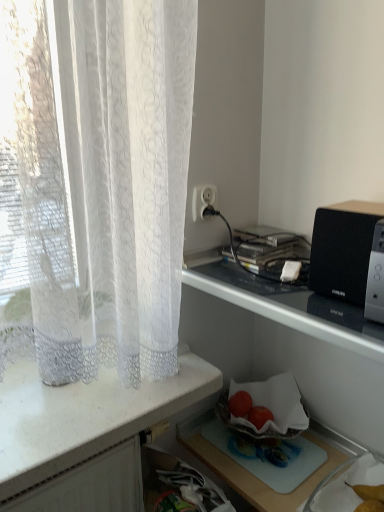
Measure the distance between yellow matte pear at lower right and camera.

A distance of 34.17 inches exists between yellow matte pear at lower right and camera.

This screenshot has width=384, height=512. I want to click on yellow matte pear at lower right, so click(369, 497).

Describe the element at coordinates (287, 342) in the screenshot. I see `metallic silver microwave at upper right` at that location.

Identify the location of white lace curtain at left. (85, 436).

Image resolution: width=384 pixels, height=512 pixels. Find the location of `smooth red strawberries at center, the first fruit when ordered from right to left`. smooth red strawberries at center, the first fruit when ordered from right to left is located at coordinates (259, 416).

What do you see at coordinates (259, 416) in the screenshot?
I see `smooth red strawberries at center, which is the second fruit from left to right` at bounding box center [259, 416].

At what (x,y) coordinates should I click in order to perform the action: click on white plastic socket at upper center. Please return your answer as a coordinate pair (x, y). Looking at the image, I should click on (203, 200).

Describe the element at coordinates (343, 250) in the screenshot. I see `black plastic speaker at upper right` at that location.

From the picture: What is the approximate width of translucent glass bowl at lower center?

The width of translucent glass bowl at lower center is 8.11 inches.

Measure the distance between point (x=229, y=408) and camera.

Point (x=229, y=408) is 3.77 feet from camera.

I want to click on yellow matte pear at lower right, so click(x=369, y=497).

Is translucent glass bowl at lower center far from red matte tomato at lower center, marked as the 2th fruit in a right-to-left arrangement?

They are positioned close to each other.

From the image's perspective, which is below, translucent glass bowl at lower center or red matte tomato at lower center, marked as the 2th fruit in a right-to-left arrangement?

translucent glass bowl at lower center, from the image's perspective.

Is translucent glass bowl at lower center wider or thinner than red matte tomato at lower center, which is the 1th fruit from left to right?

Clearly, translucent glass bowl at lower center has more width compared to red matte tomato at lower center, which is the 1th fruit from left to right.

Where is `table in front of the red matte tomato at lower center, marked as the 2th fruit in a right-to-left arrangement`? This screenshot has height=512, width=384. table in front of the red matte tomato at lower center, marked as the 2th fruit in a right-to-left arrangement is located at coordinates (249, 472).

In terms of height, does white plastic socket at upper center look taller or shorter compared to translucent glass bowl at lower center?

Considering their sizes, white plastic socket at upper center has more height than translucent glass bowl at lower center.

Is white plastic socket at upper center touching translucent glass bowl at lower center?

No, white plastic socket at upper center is not touching translucent glass bowl at lower center.

Does white plastic socket at upper center have a greater width compared to translucent glass bowl at lower center?

In fact, white plastic socket at upper center might be narrower than translucent glass bowl at lower center.

Is white plastic socket at upper center at the left side of translucent glass bowl at lower center?

Correct, you'll find white plastic socket at upper center to the left of translucent glass bowl at lower center.

Is yellow matte pear at lower right further to camera compared to white plastic socket at upper center?

No, the depth of yellow matte pear at lower right is less than that of white plastic socket at upper center.

Are yellow matte pear at lower right and white plastic socket at upper center far apart?

No.

Is yellow matte pear at lower right outside of white plastic socket at upper center?

yellow matte pear at lower right is positioned outside white plastic socket at upper center.

Is white plastic socket at upper center at the back of yellow matte pear at lower right?

No, yellow matte pear at lower right's orientation is not away from white plastic socket at upper center.

How distant is red matte tomato at lower center, marked as the 2th fruit in a right-to-left arrangement, from white plastic socket at upper center?

red matte tomato at lower center, marked as the 2th fruit in a right-to-left arrangement, is 20.89 inches away from white plastic socket at upper center.

Does red matte tomato at lower center, marked as the 2th fruit in a right-to-left arrangement, contain white plastic socket at upper center?

No, white plastic socket at upper center is not inside red matte tomato at lower center, marked as the 2th fruit in a right-to-left arrangement.

Based on the photo, is red matte tomato at lower center, marked as the 2th fruit in a right-to-left arrangement, to the left or to the right of white plastic socket at upper center in the image?

Clearly, red matte tomato at lower center, marked as the 2th fruit in a right-to-left arrangement, is on the right of white plastic socket at upper center in the image.

Is red matte tomato at lower center, marked as the 2th fruit in a right-to-left arrangement, far away from white plastic socket at upper center?

That's not correct — red matte tomato at lower center, marked as the 2th fruit in a right-to-left arrangement, is a little close to white plastic socket at upper center.

Is translucent glass bowl at lower center looking in the opposite direction of black plastic speaker at upper right?

No.

Is translucent glass bowl at lower center with black plastic speaker at upper right?

No, translucent glass bowl at lower center is not in contact with black plastic speaker at upper right.

What are the coordinates of `appliance on the right of translucent glass bowl at lower center` in the screenshot? It's located at (343, 250).

Image resolution: width=384 pixels, height=512 pixels. In the image, there is a smooth red strawberries at center, the first fruit when ordered from right to left. Identify the location of appliance above it (from the image's perspective). (343, 250).

Is smooth red strawberries at center, the first fruit when ordered from right to left, turned away from black plastic speaker at upper right?

No, smooth red strawberries at center, the first fruit when ordered from right to left, is not facing the opposite direction of black plastic speaker at upper right.

Considering the relative positions of smooth red strawberries at center, the first fruit when ordered from right to left, and black plastic speaker at upper right in the image provided, is smooth red strawberries at center, the first fruit when ordered from right to left, to the right of black plastic speaker at upper right from the viewer's perspective?

Incorrect, smooth red strawberries at center, the first fruit when ordered from right to left, is not on the right side of black plastic speaker at upper right.

Is smooth red strawberries at center, which is the second fruit from left to right, situated inside black plastic speaker at upper right or outside?

smooth red strawberries at center, which is the second fruit from left to right, exists outside the volume of black plastic speaker at upper right.

Considering the relative positions of metallic silver microwave at upper right and black plastic speaker at upper right in the image provided, is metallic silver microwave at upper right behind black plastic speaker at upper right?

No.

Could you tell me if metallic silver microwave at upper right is turned towards black plastic speaker at upper right?

No, metallic silver microwave at upper right is not oriented towards black plastic speaker at upper right.

Where is `shelf that appears below the black plastic speaker at upper right (from the image's perspective)`? shelf that appears below the black plastic speaker at upper right (from the image's perspective) is located at coordinates (287, 342).

Is metallic silver microwave at upper right next to black plastic speaker at upper right?

metallic silver microwave at upper right and black plastic speaker at upper right are clearly separated.

Locate an element on the screen. The image size is (384, 512). table that appears in front of the red matte tomato at lower center, which is the 1th fruit from left to right is located at coordinates (249, 472).

What are the coordinates of `table located on the right of white plastic socket at upper center` in the screenshot? It's located at (249, 472).

In the scene shown: When comparing their distances from red matte tomato at lower center, which is the 1th fruit from left to right, does white lace curtain at left or metallic silver microwave at upper right seem further?

white lace curtain at left is further to red matte tomato at lower center, which is the 1th fruit from left to right.

From the image, which object appears to be farther from red matte tomato at lower center, which is the 1th fruit from left to right, white lace curtain at left or translucent glass bowl at lower center?

white lace curtain at left lies further to red matte tomato at lower center, which is the 1th fruit from left to right, than the other object.

From the image, which object appears to be nearer to black plastic speaker at upper right, yellow matte pear at lower right or translucent glass bowl at lower center?

Based on the image, yellow matte pear at lower right appears to be nearer to black plastic speaker at upper right.

Which object lies further to the anchor point yellow matte pear at lower right, red matte tomato at lower center, which is the 1th fruit from left to right, or white lace curtain at left?

The object further to yellow matte pear at lower right is white lace curtain at left.

From the image, which object appears to be nearer to smooth red strawberries at center, the first fruit when ordered from right to left, white plastic socket at upper center or translucent glass bowl at lower center?

translucent glass bowl at lower center lies closer to smooth red strawberries at center, the first fruit when ordered from right to left, than the other object.

Based on the photo, based on their spatial positions, is metallic silver microwave at upper right or red matte tomato at lower center, which is the 1th fruit from left to right, closer to black plastic speaker at upper right?

metallic silver microwave at upper right.

Looking at the image, which one is located further to white lace curtain at left, black plastic speaker at upper right or white plastic socket at upper center?

The object further to white lace curtain at left is white plastic socket at upper center.

When comparing their distances from metallic silver microwave at upper right, does white lace curtain at left or black plastic speaker at upper right seem further?

The object further to metallic silver microwave at upper right is white lace curtain at left.

Locate an element on the screen. This screenshot has width=384, height=512. table between yellow matte pear at lower right and smooth red strawberries at center, the first fruit when ordered from right to left, from front to back is located at coordinates (249, 472).

Where is `fruit between white plastic socket at upper center and smooth red strawberries at center, the first fruit when ordered from right to left, vertically`? fruit between white plastic socket at upper center and smooth red strawberries at center, the first fruit when ordered from right to left, vertically is located at coordinates (240, 404).

Locate an element on the screen. food positioned between metallic silver microwave at upper right and smooth red strawberries at center, which is the second fruit from left to right, from near to far is located at coordinates (369, 497).

Identify the location of appliance between metallic silver microwave at upper right and red matte tomato at lower center, which is the 1th fruit from left to right, along the z-axis. The width and height of the screenshot is (384, 512). (343, 250).